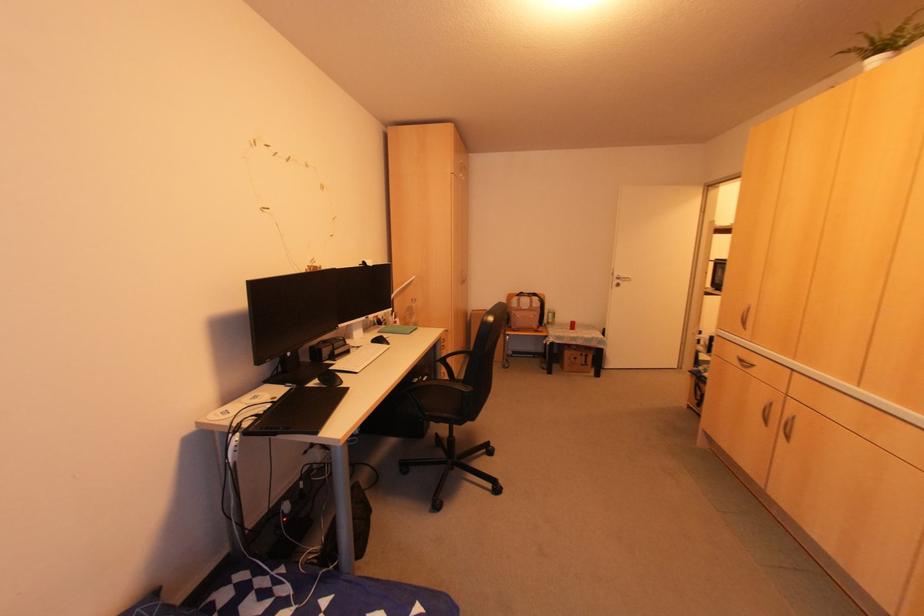
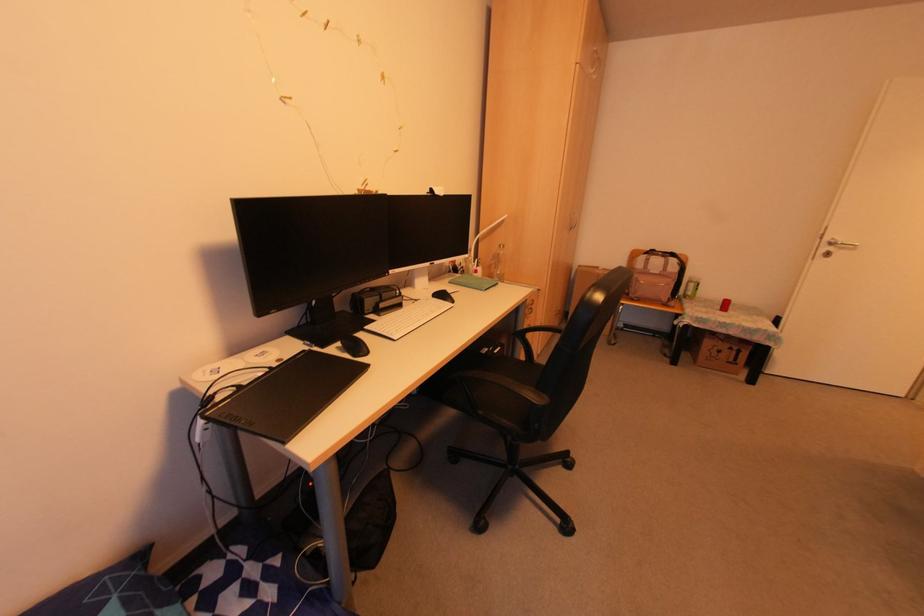
Find the pixel in the second image that matches point (305, 166) in the first image.

(358, 41)